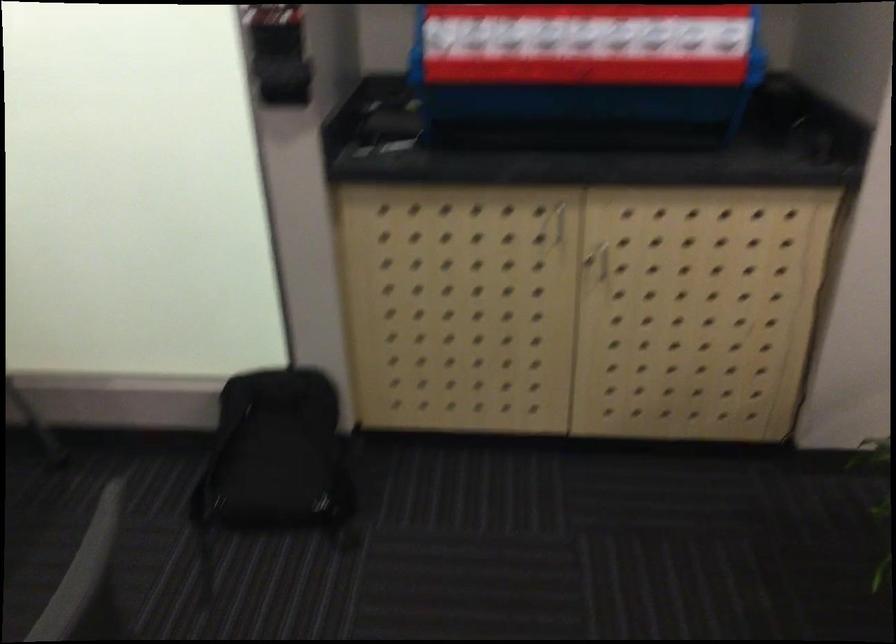
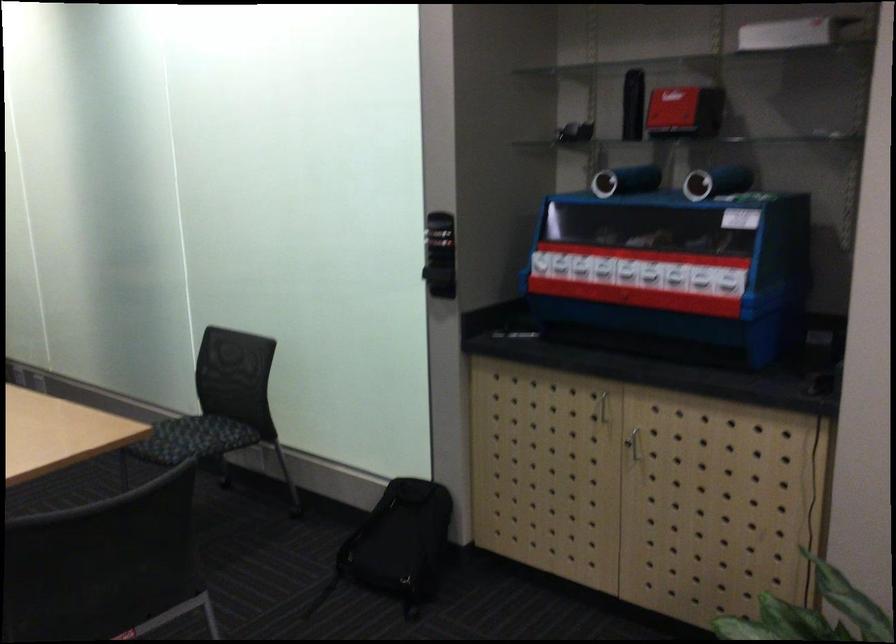
The point at (285, 467) is marked in the first image. Where is the corresponding point in the second image?

(398, 545)